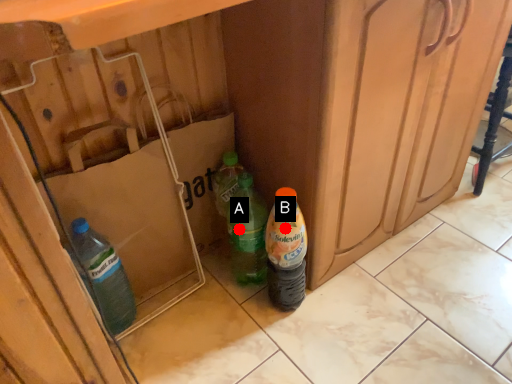
Question: Two points are circled on the image, labeled by A and B beside each circle. Which point appears farthest from the camera in this image?

Choices:
 (A) A is further
 (B) B is further

Answer: (A)